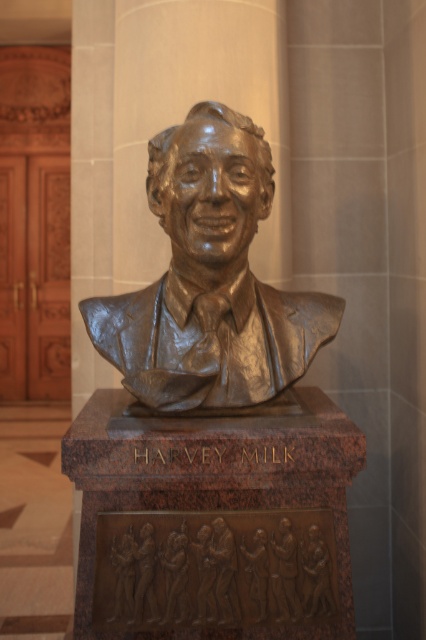
You are standing in front of the bronze bust of Harvey Milk. You want to take a photo of both the shiny bronze bust at center and the bronze relief figures at center. Which one should you focus on first if you want to capture both in one frame without moving the camera?

The shiny bronze bust at center is above the bronze relief figures at center, so you should focus on the shiny bronze bust at center first to ensure both are in the frame.

You are an art student analyzing the sculpture. You notice the shiny bronze bust at center and the bronze relief figures at center. Which object is wider?

The shiny bronze bust at center is wider than the bronze relief figures at center.